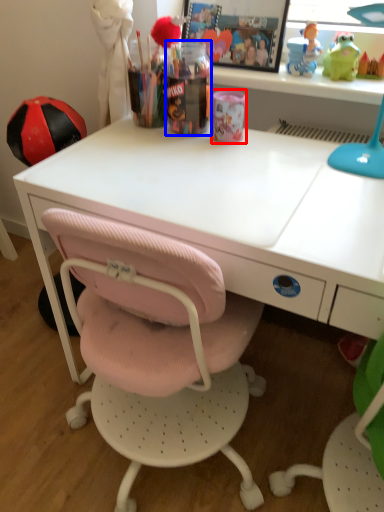
Question: Which of the following is the closest to the observer, stationery (highlighted by a red box) or stationery (highlighted by a blue box)?

Choices:
 (A) stationery
 (B) stationery

Answer: (B)